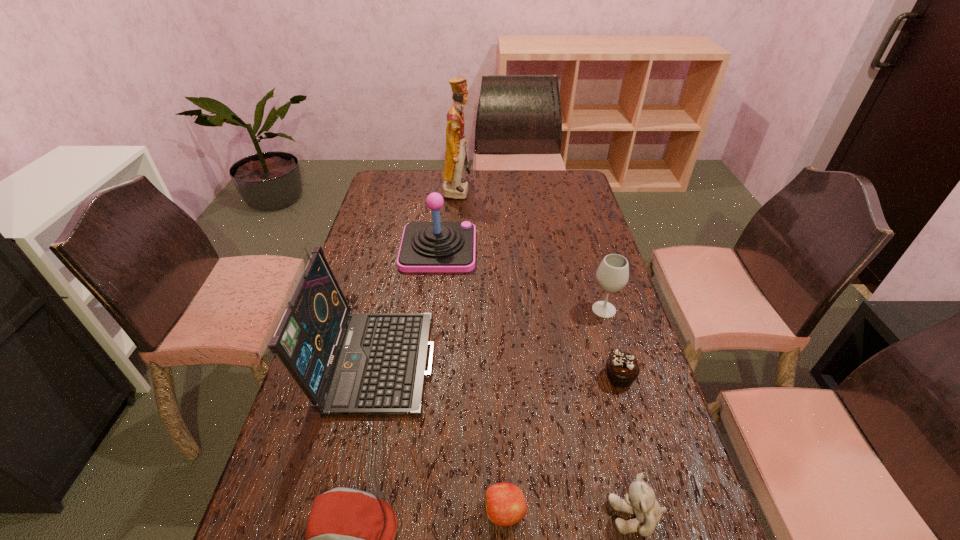
Where is `free location located 0.170m on the left of the wineglass`? free location located 0.170m on the left of the wineglass is located at coordinates tap(534, 310).

Where is `vacant point located 0.290m on the front of the cupcake`? This screenshot has height=540, width=960. vacant point located 0.290m on the front of the cupcake is located at coordinates (658, 509).

Locate an element on the screen. The height and width of the screenshot is (540, 960). vacant area located 0.290m on the right of the fourth object from right to left is located at coordinates (665, 512).

What are the coordinates of `object that is positioned at the far edge` in the screenshot? It's located at (454, 186).

Find the location of a particular element. The height and width of the screenshot is (540, 960). object that is at the left edge is located at coordinates (347, 363).

I want to click on wineglass positioned at the right edge, so click(612, 275).

You are a GUI agent. You are given a task and a screenshot of the screen. Output one action in this format:
    pyautogui.click(x=<x>, y=<y>)
    Task: Click on the cupcake located in the right edge section of the desktop
    The width and height of the screenshot is (960, 540).
    Given the screenshot: What is the action you would take?
    pyautogui.click(x=622, y=367)

Find the location of `vacant area at the far edge of the desktop`. vacant area at the far edge of the desktop is located at coordinates (415, 195).

Where is `vacant space at the left edge of the desktop`? The height and width of the screenshot is (540, 960). vacant space at the left edge of the desktop is located at coordinates (286, 508).

The width and height of the screenshot is (960, 540). In order to click on vacant space at the right edge of the desktop in this screenshot , I will do `click(599, 375)`.